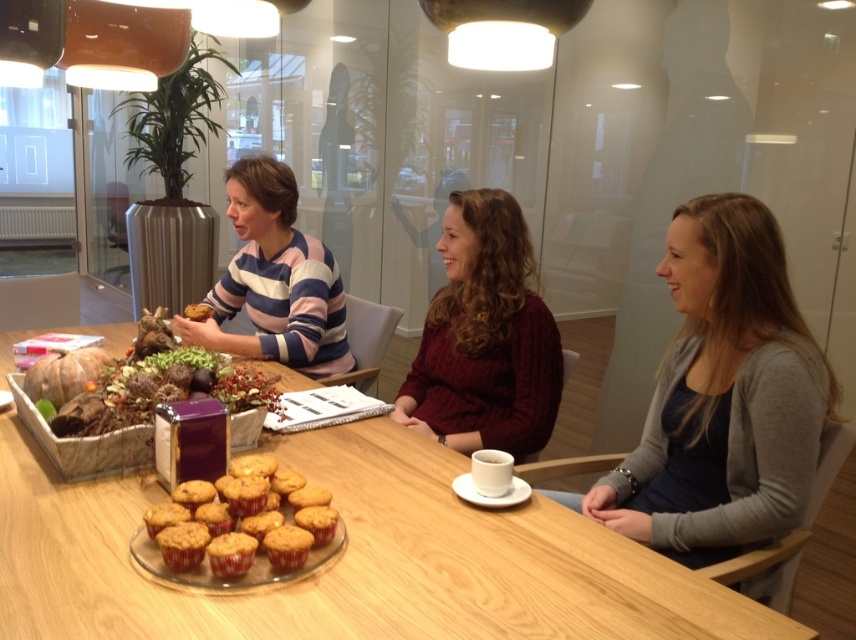
Can you confirm if wooden table at center is positioned below golden-brown muffin at center?

No.

Can you confirm if wooden table at center is wider than golden-brown muffin at center?

Correct, the width of wooden table at center exceeds that of golden-brown muffin at center.

Is point (201, 616) positioned after point (221, 556)?

No, (201, 616) is in front of (221, 556).

Locate an element on the screen. The height and width of the screenshot is (640, 856). wooden table at center is located at coordinates (352, 561).

Is gray sweater at right wider than golden crumbly muffins at center?

Yes, gray sweater at right is wider than golden crumbly muffins at center.

Does gray sweater at right have a larger size compared to golden crumbly muffins at center?

Yes.

Where is `gray sweater at right`? This screenshot has width=856, height=640. gray sweater at right is located at coordinates (724, 396).

Which is above, cable-knit sweater at center or white ceramic cup at center?

Positioned higher is cable-knit sweater at center.

Which is behind, point (527, 358) or point (510, 468)?

Positioned behind is point (527, 358).

Identify the location of cable-knit sweater at center. (484, 337).

Image resolution: width=856 pixels, height=640 pixels. Identify the location of cable-knit sweater at center. (484, 337).